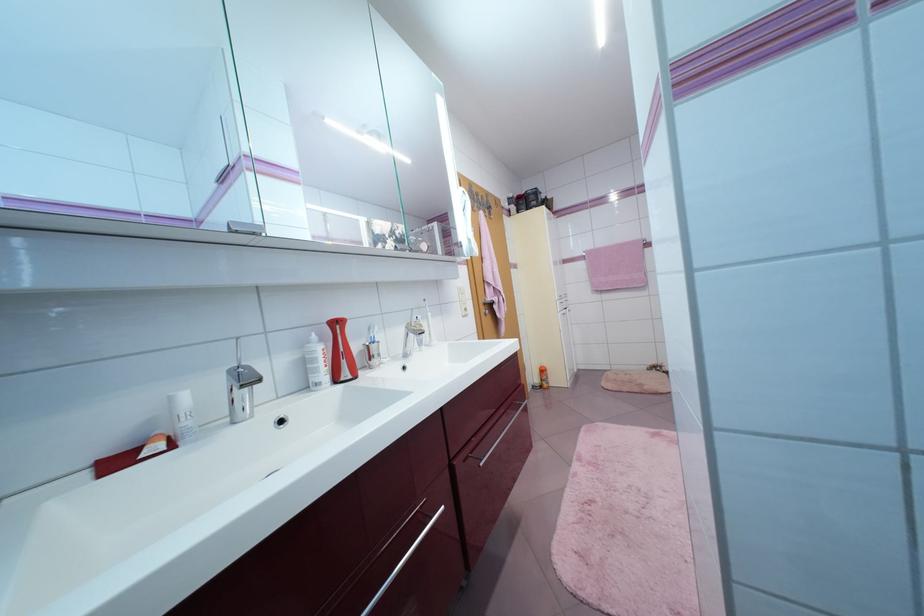
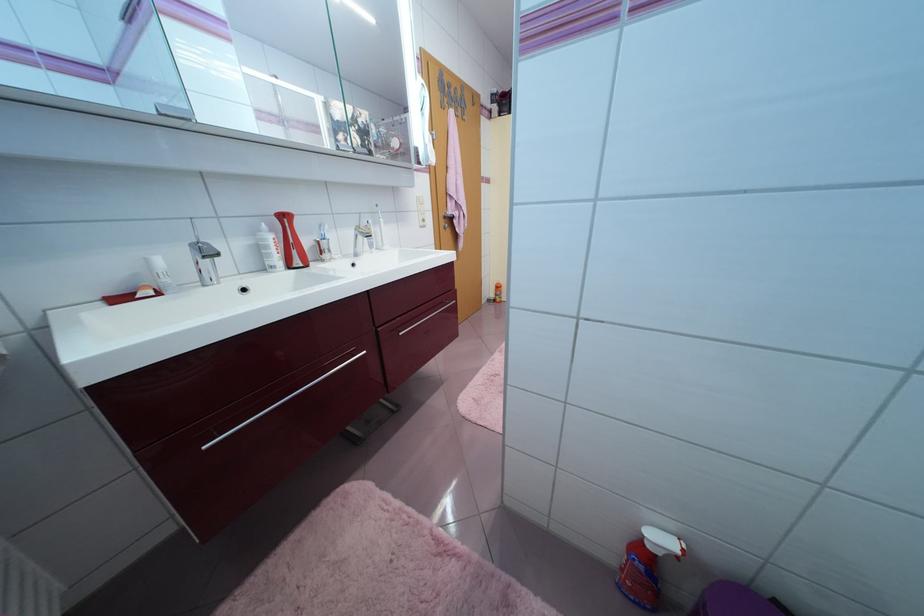
Where in the second image is the point corresponding to (234,373) from the first image?

(196, 246)